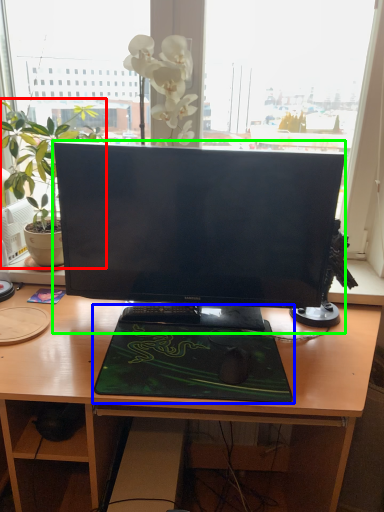
Question: Based on their relative distances, which object is farther from houseplant (highlighted by a red box)? Choose from desktop (highlighted by a blue box) and computer monitor (highlighted by a green box).

Choices:
 (A) desktop
 (B) computer monitor

Answer: (A)